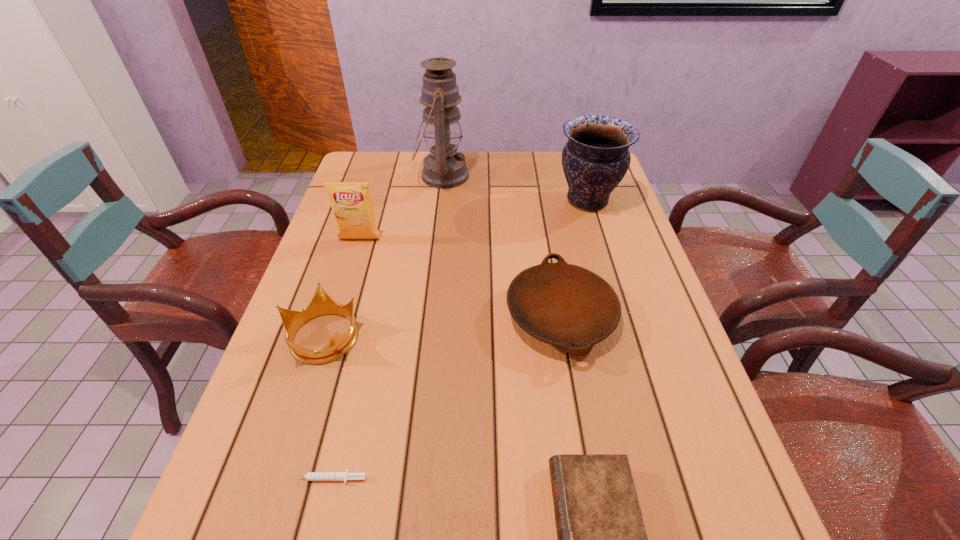
This screenshot has height=540, width=960. Identify the location of blank space that satisfies the following two spatial constraints: 1. on the front handle of the pottery; 2. on the front side of the crown. pos(629,336).